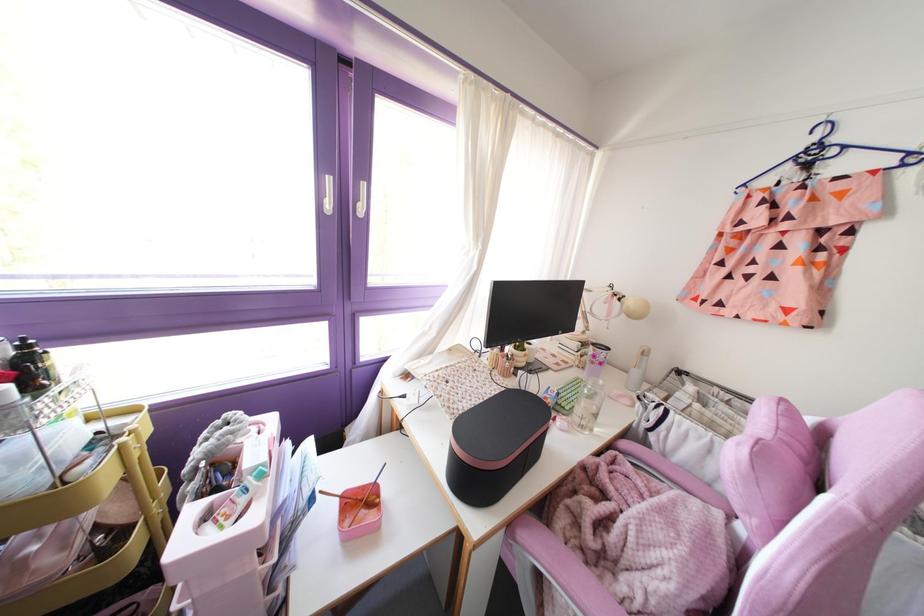
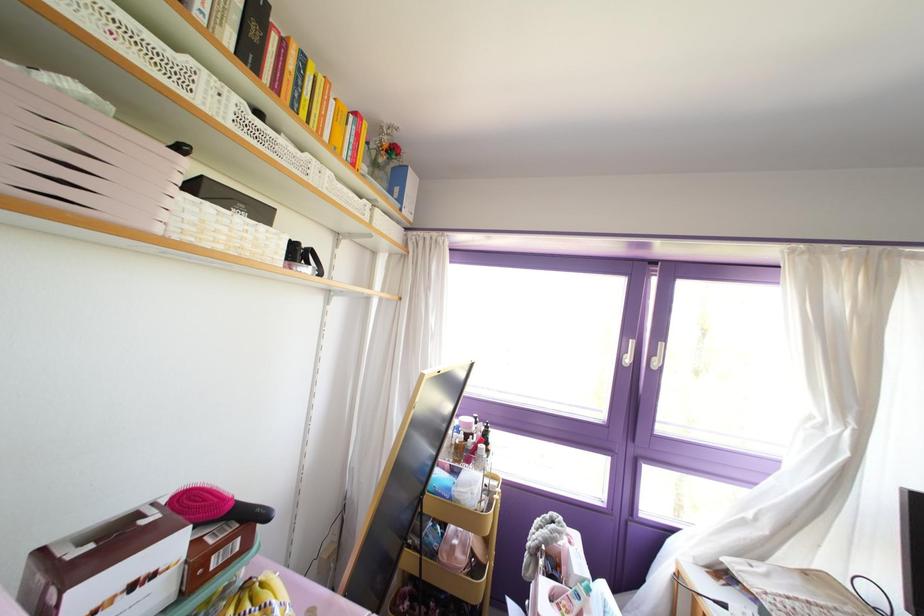
Find the pixel in the second image that matches the point at 329,205 in the first image.

(626, 360)